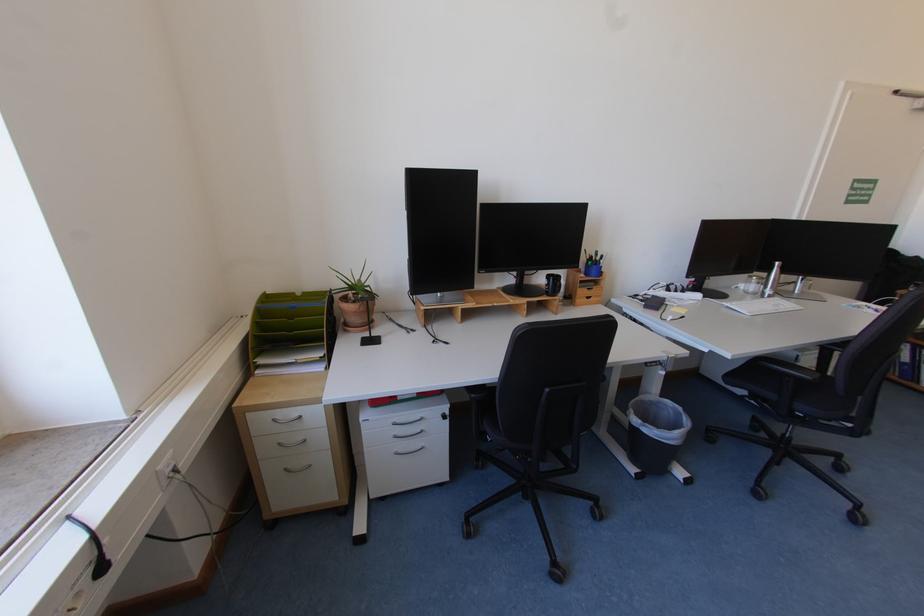
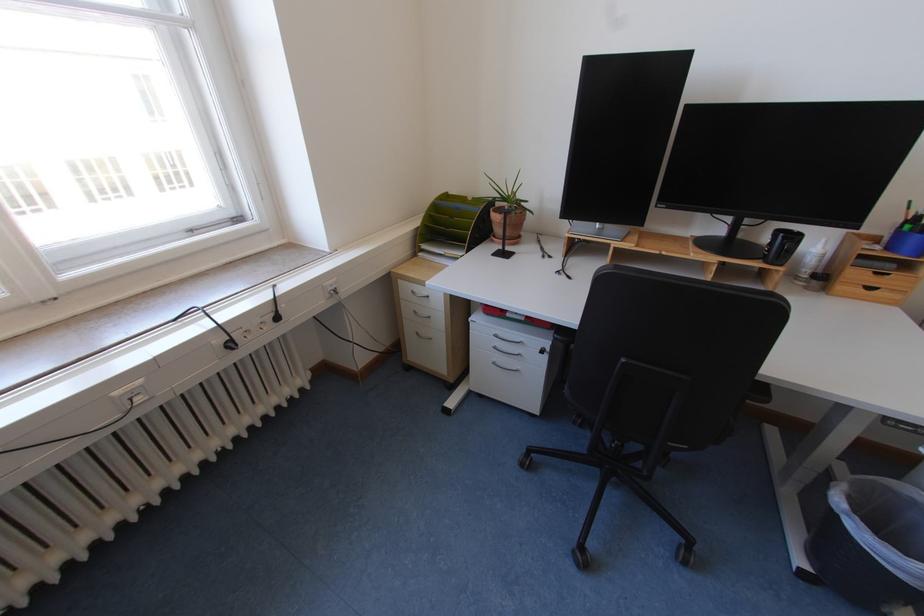
Where in the second image is the point corresponding to [585,297] from the first image?

(848, 281)